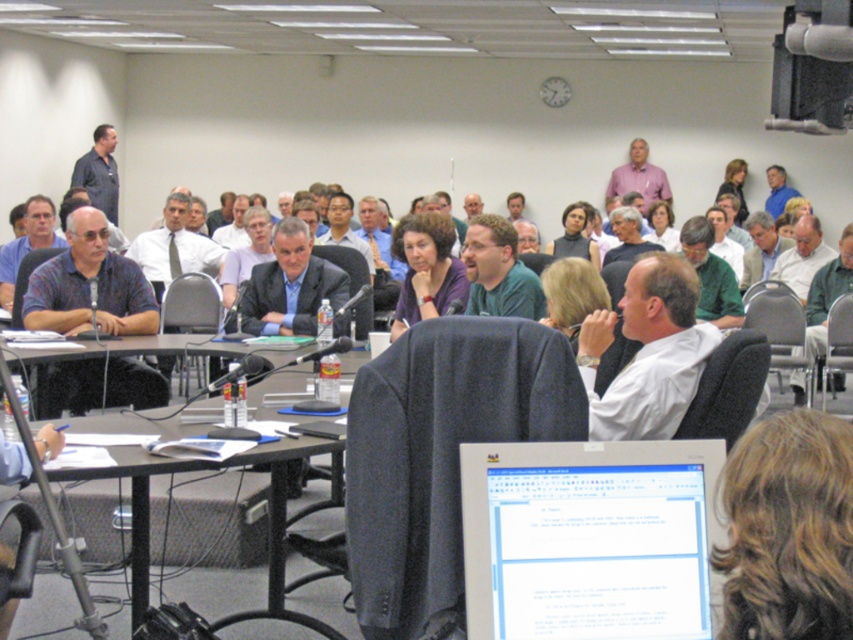
Question: Which point is closer to the camera taking this photo?

Choices:
 (A) (479, 584)
 (B) (825, 330)
 (C) (654, 419)
 (D) (141, 397)

Answer: (A)

Question: Estimate the real-world distances between objects in this image. Which object is farther from the green shirt at center?

Choices:
 (A) matte blue shirt at center
 (B) black plastic table at center
 (C) dark blue suit at center

Answer: (A)

Question: Is white plastic monitor at center to the right of black plastic table at center from the viewer's perspective?

Choices:
 (A) no
 (B) yes

Answer: (B)

Question: In this image, where is dark blue shirt at left located relative to matte blue shirt at center?

Choices:
 (A) left
 (B) right

Answer: (B)

Question: Where is purple matte shirt at center located in relation to green matte shirt at center in the image?

Choices:
 (A) above
 (B) below

Answer: (A)

Question: Which point is closer to the camera taking this photo?

Choices:
 (A) (113, 195)
 (B) (672, 429)
 (C) (303, 257)
 (D) (645, 477)

Answer: (D)